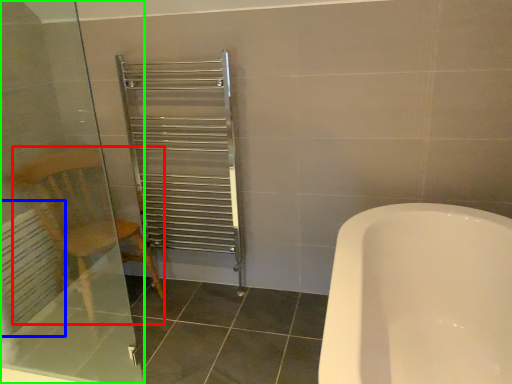
Question: Which object is the closest to the armchair (highlighted by a red box)? Choose among these: radiator (highlighted by a blue box) or screen door (highlighted by a green box).

Choices:
 (A) radiator
 (B) screen door

Answer: (B)